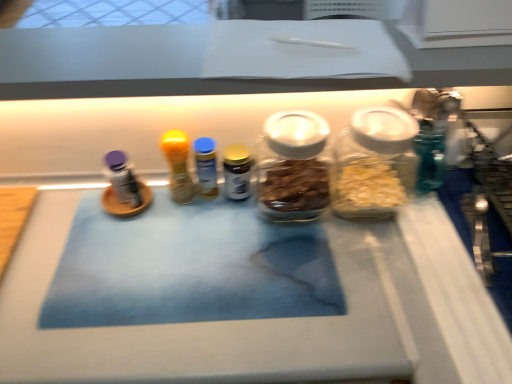
Question: Is yellow matte bottle at center, marked as the 1th bottle in a left-to-right arrangement, a part of blue plastic bottle at center, the second bottle viewed from the left?

Choices:
 (A) no
 (B) yes

Answer: (A)

Question: Considering the relative positions of blue plastic bottle at center, which is the fourth bottle from right to left, and yellow matte bottle at center, the fifth bottle positioned from the right, in the image provided, is blue plastic bottle at center, which is the fourth bottle from right to left, to the left of yellow matte bottle at center, the fifth bottle positioned from the right, from the viewer's perspective?

Choices:
 (A) no
 (B) yes

Answer: (A)

Question: Does blue plastic bottle at center, which is the fourth bottle from right to left, have a greater height compared to yellow matte bottle at center, marked as the 1th bottle in a left-to-right arrangement?

Choices:
 (A) yes
 (B) no

Answer: (B)

Question: Considering the relative sizes of blue plastic bottle at center, which is the fourth bottle from right to left, and yellow matte bottle at center, the fifth bottle positioned from the right, in the image provided, is blue plastic bottle at center, which is the fourth bottle from right to left, bigger than yellow matte bottle at center, the fifth bottle positioned from the right,?

Choices:
 (A) yes
 (B) no

Answer: (B)

Question: Is blue plastic bottle at center, the second bottle viewed from the left, in front of yellow matte bottle at center, marked as the 1th bottle in a left-to-right arrangement?

Choices:
 (A) no
 (B) yes

Answer: (A)

Question: Is point (211, 155) positioned closer to the camera than point (290, 220)?

Choices:
 (A) closer
 (B) farther

Answer: (A)

Question: Looking at their shapes, would you say blue plastic bottle at center, the second bottle viewed from the left, is wider or thinner than transparent glass jar at center, which appears as the 2th bottle when viewed from the right?

Choices:
 (A) thin
 (B) wide

Answer: (A)

Question: Would you say blue plastic bottle at center, which is the fourth bottle from right to left, is inside or outside transparent glass jar at center, which appears as the 2th bottle when viewed from the right?

Choices:
 (A) outside
 (B) inside

Answer: (A)

Question: Considering the relative positions of blue plastic bottle at center, which is the fourth bottle from right to left, and transparent glass jar at center, the 4th bottle when ordered from left to right, in the image provided, is blue plastic bottle at center, which is the fourth bottle from right to left, to the left or to the right of transparent glass jar at center, the 4th bottle when ordered from left to right,?

Choices:
 (A) left
 (B) right

Answer: (A)

Question: Considering their positions, is blue plastic bottle at center, the second bottle viewed from the left, located in front of or behind translucent glass jar at right, the 1th bottle when ordered from right to left?

Choices:
 (A) behind
 (B) front

Answer: (A)

Question: Is blue plastic bottle at center, the second bottle viewed from the left, wider or thinner than translucent glass jar at right, marked as the fifth bottle in a left-to-right arrangement?

Choices:
 (A) wide
 (B) thin

Answer: (B)

Question: Is point (202, 175) positioned closer to the camera than point (352, 127)?

Choices:
 (A) farther
 (B) closer

Answer: (A)

Question: Visually, is blue plastic bottle at center, the second bottle viewed from the left, positioned to the left or to the right of translucent glass jar at right, the 1th bottle when ordered from right to left?

Choices:
 (A) left
 (B) right

Answer: (A)

Question: Based on their sizes in the image, would you say gold metallic spice jar at center, the third bottle from the left, is bigger or smaller than blue plastic bottle at center, which is the fourth bottle from right to left?

Choices:
 (A) big
 (B) small

Answer: (B)

Question: Is gold metallic spice jar at center, the third bottle from the left, in front of or behind blue plastic bottle at center, the second bottle viewed from the left, in the image?

Choices:
 (A) front
 (B) behind

Answer: (B)